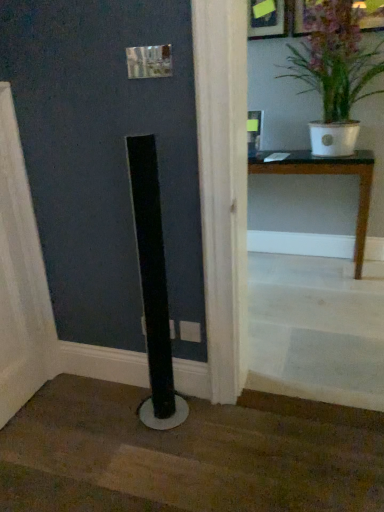
Question: Does point (360, 61) appear closer or farther from the camera than point (51, 456)?

Choices:
 (A) closer
 (B) farther

Answer: (B)

Question: Is white glossy pot at upper right spatially inside black matte pole at lower center, positioned as the first stairwell in bottom-to-top order, or outside of it?

Choices:
 (A) outside
 (B) inside

Answer: (A)

Question: Which object is positioned farthest from the wooden table at center?

Choices:
 (A) white wooden stairs at lower right, the 2th stairwell in the bottom-to-top sequence
 (B) black matte pole at lower center, which appears as the 2th stairwell when viewed from the top
 (C) white glossy pot at upper right

Answer: (B)

Question: Which of these objects is positioned closest to the wooden table at center?

Choices:
 (A) white wooden stairs at lower right, the 2th stairwell in the bottom-to-top sequence
 (B) white glossy pot at upper right
 (C) black matte pole at lower center, positioned as the first stairwell in bottom-to-top order

Answer: (B)